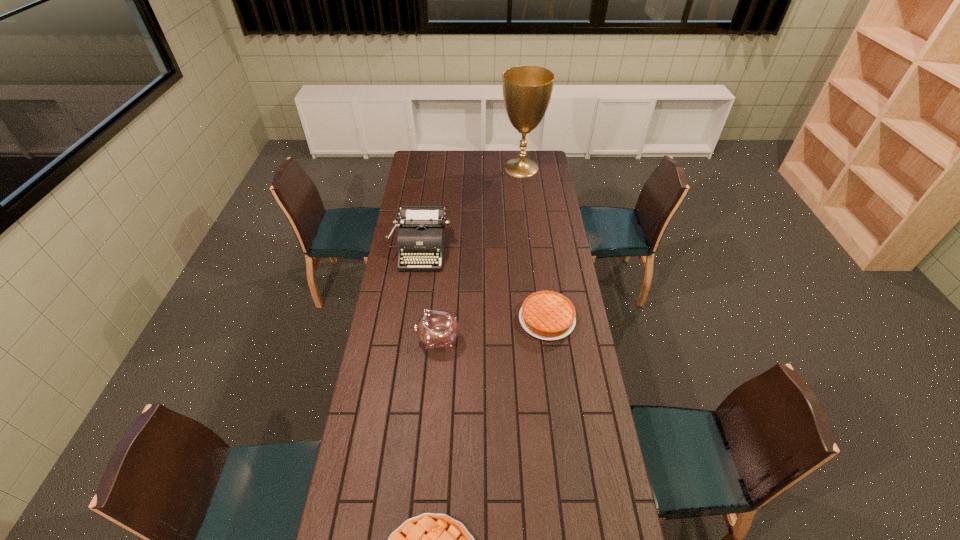
At what (x,y) coordinates should I click in order to perform the action: click on object that is at the far edge. Please return your answer as a coordinate pair (x, y). Image resolution: width=960 pixels, height=540 pixels. Looking at the image, I should click on (527, 90).

The height and width of the screenshot is (540, 960). I want to click on object located in the left edge section of the desktop, so click(x=421, y=234).

Locate an element on the screen. trophy cup at the right edge is located at coordinates (527, 90).

At what (x,y) coordinates should I click in order to perform the action: click on pie at the right edge. Please return your answer as a coordinate pair (x, y). The width and height of the screenshot is (960, 540). Looking at the image, I should click on (548, 315).

You are a GUI agent. You are given a task and a screenshot of the screen. Output one action in this format:
    pyautogui.click(x=<x>, y=<y>)
    Task: Click on the object located at the far right corner
    The width and height of the screenshot is (960, 540).
    Given the screenshot: What is the action you would take?
    pyautogui.click(x=527, y=90)

Where is `vacant space at the left edge`? Image resolution: width=960 pixels, height=540 pixels. vacant space at the left edge is located at coordinates (410, 296).

The width and height of the screenshot is (960, 540). In the image, there is a desktop. Identify the location of vacant area at the right edge. (573, 426).

The width and height of the screenshot is (960, 540). What are the coordinates of `vacant space at the far left corner` in the screenshot? It's located at click(424, 158).

Locate an element on the screen. vacant area that lies between the typewriter and the farther pie is located at coordinates (484, 284).

The width and height of the screenshot is (960, 540). Find the location of `free spot between the fourth nearest object and the piggy bank`. free spot between the fourth nearest object and the piggy bank is located at coordinates 429,295.